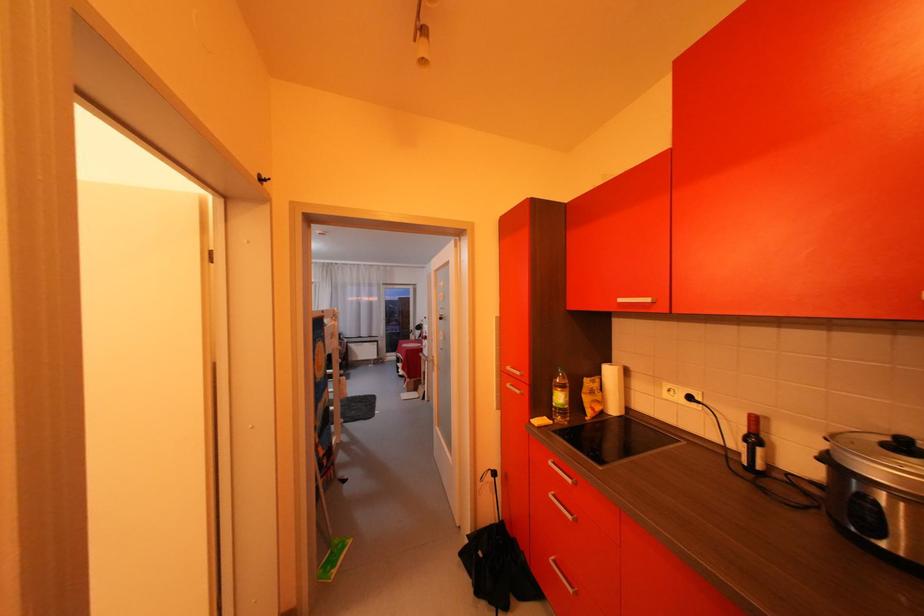
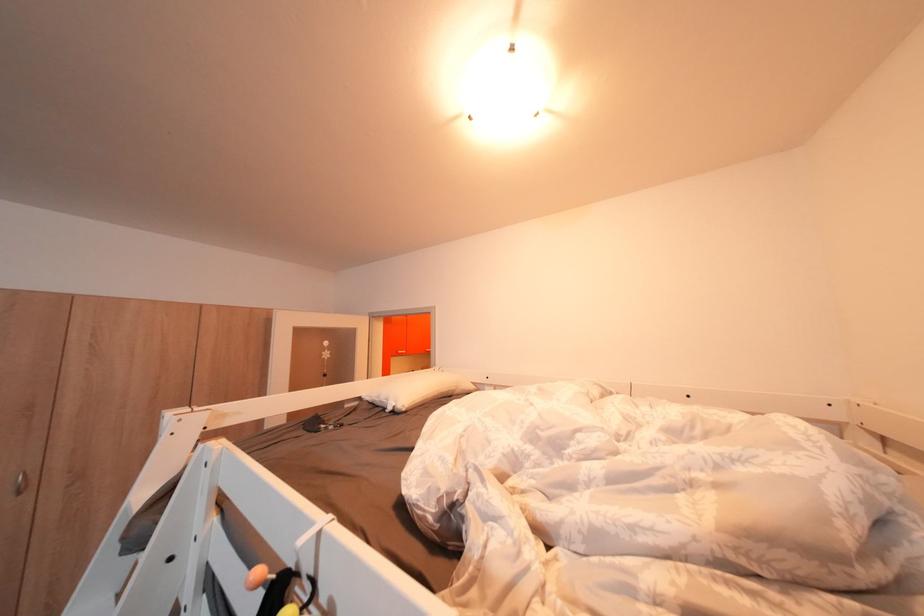
Question: I am providing you with two images of the same scene from different viewpoints. Which of the following objects are not visible in image2?

Choices:
 (A) white pillow
 (B) cooker lid handle
 (C) red spiral notebook
 (D) white bed rail

Answer: (B)